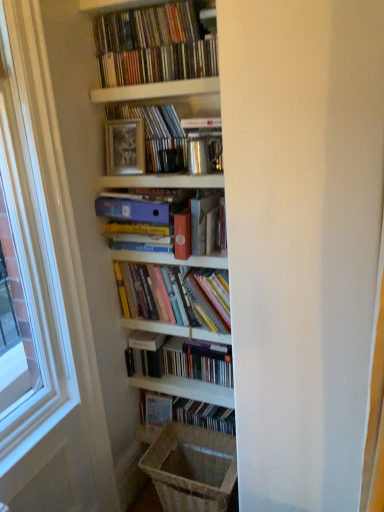
In order to click on free space above hardcover book at center, which is the fifth book in bottom-to-top order (from a real-world perspective) in this screenshot , I will do `click(153, 103)`.